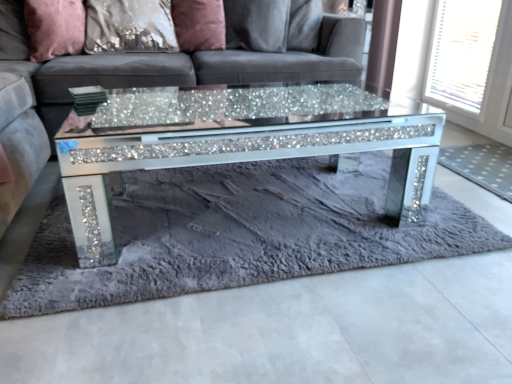
Question: Can you confirm if satin sequin pillow at upper center, which ranks as the 2th pillow in right-to-left order, is wider than satin pink pillow at upper center, the first pillow positioned from the right?

Choices:
 (A) no
 (B) yes

Answer: (B)

Question: Is the position of satin sequin pillow at upper center, arranged as the second pillow when viewed from the left, less distant than that of satin pink pillow at upper center, the third pillow from the left?

Choices:
 (A) yes
 (B) no

Answer: (A)

Question: Can you see satin sequin pillow at upper center, which ranks as the 2th pillow in right-to-left order, touching satin pink pillow at upper center, the third pillow from the left?

Choices:
 (A) no
 (B) yes

Answer: (A)

Question: Is satin sequin pillow at upper center, which ranks as the 2th pillow in right-to-left order, located outside satin pink pillow at upper center, the third pillow from the left?

Choices:
 (A) no
 (B) yes

Answer: (B)

Question: From the image's perspective, is satin sequin pillow at upper center, arranged as the second pillow when viewed from the left, located beneath satin pink pillow at upper center, the third pillow from the left?

Choices:
 (A) yes
 (B) no

Answer: (A)

Question: From the image's perspective, is satin sequin pillow at upper center, which ranks as the 2th pillow in right-to-left order, located above satin pink pillow at upper center, the third pillow from the left?

Choices:
 (A) yes
 (B) no

Answer: (B)

Question: Are white mesh screen at upper right and sparkly glass coffee table at center far apart?

Choices:
 (A) yes
 (B) no

Answer: (A)

Question: Does white mesh screen at upper right have a smaller size compared to sparkly glass coffee table at center?

Choices:
 (A) no
 (B) yes

Answer: (B)

Question: Would you say sparkly glass coffee table at center is part of white mesh screen at upper right's contents?

Choices:
 (A) yes
 (B) no

Answer: (B)

Question: Is white mesh screen at upper right placed right next to sparkly glass coffee table at center?

Choices:
 (A) yes
 (B) no

Answer: (B)

Question: Can you confirm if white mesh screen at upper right is taller than sparkly glass coffee table at center?

Choices:
 (A) yes
 (B) no

Answer: (A)

Question: Is white mesh screen at upper right in front of sparkly glass coffee table at center?

Choices:
 (A) yes
 (B) no

Answer: (B)

Question: Does satin sequin pillow at upper center, which ranks as the 2th pillow in right-to-left order, appear on the left side of fuzzy gray rug at center, which is the 1th mat from left to right?

Choices:
 (A) yes
 (B) no

Answer: (A)